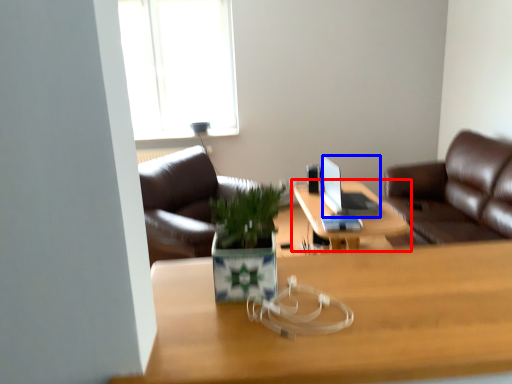
Question: Which object appears farthest to the camera in this image, table (highlighted by a red box) or laptop (highlighted by a blue box)?

Choices:
 (A) table
 (B) laptop

Answer: (B)